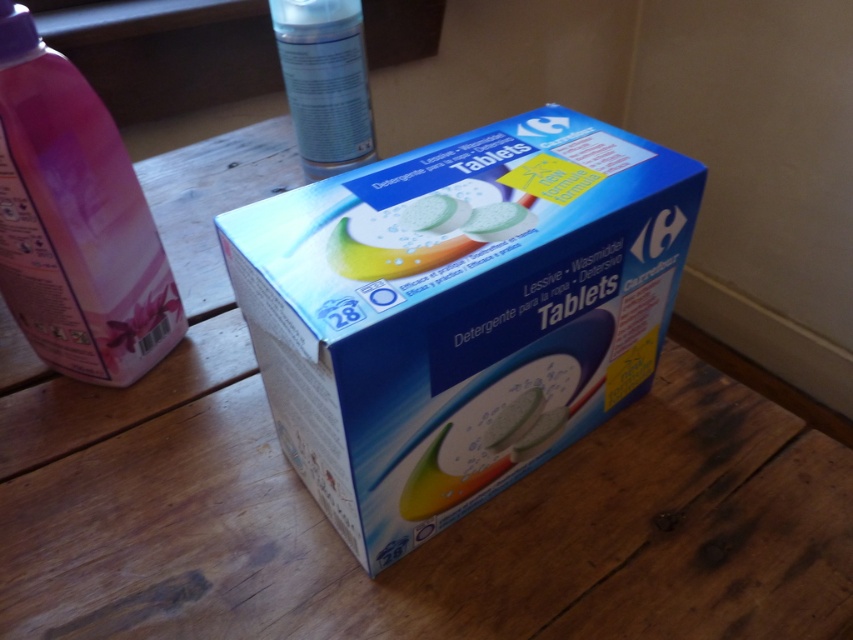
You are organizing a storage shelf and need to place the pink plastic bottle at left and the transparent plastic spray can at upper center. According to their positions in the image, which one is located higher?

The transparent plastic spray can at upper center is higher because it is positioned above the pink plastic bottle at left.

You are organizing a pantry and need to place the blue cardboard box at center and the translucent plastic tablets at center on a shelf. If the shelf has limited space, which item should you place first to ensure both fit?

The blue cardboard box at center is larger in size than the translucent plastic tablets at center, so you should place the blue cardboard box at center first to ensure both items fit on the shelf.